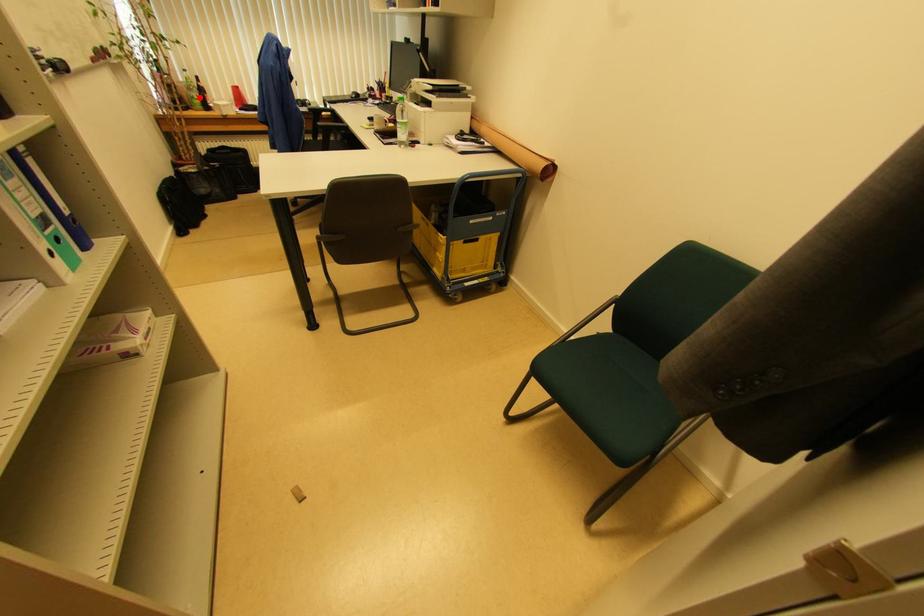
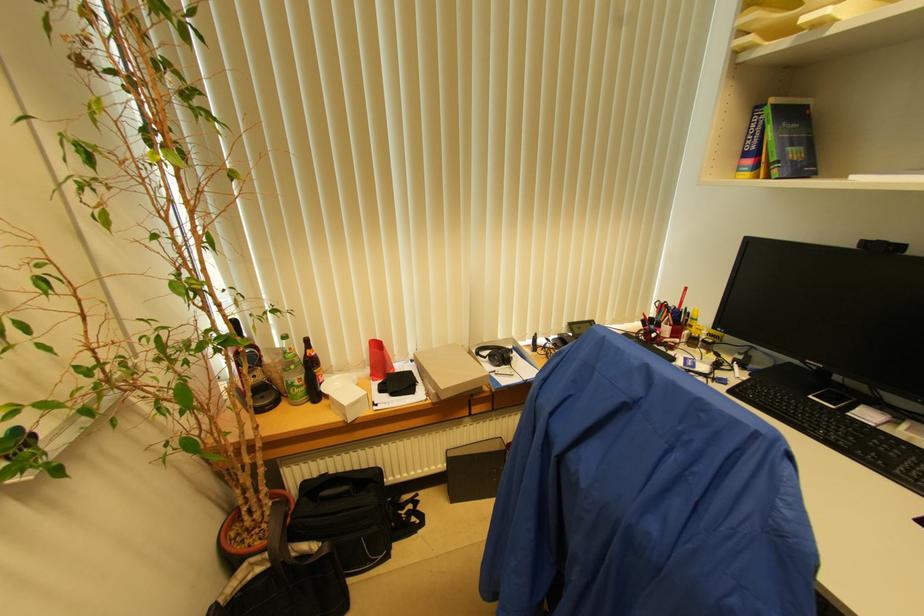
In the second image, find the point that corresponds to the highlighted location in the first image.

(304, 379)